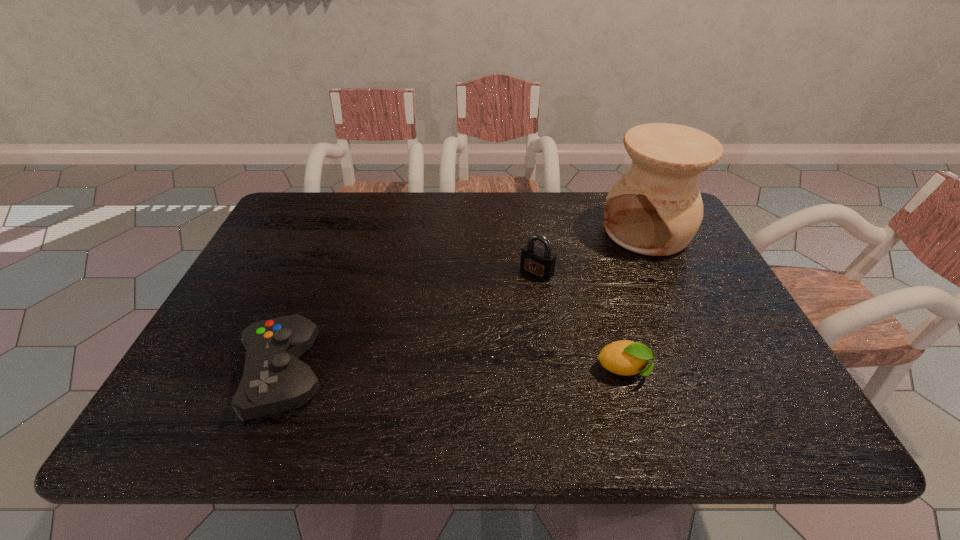
At what (x,y) coordinates should I click in order to perform the action: click on free space on the desktop that is between the leftmost object and the lemon and is positioned on the front of the third shortest object near the keyhole. Please return your answer as a coordinate pair (x, y). Image resolution: width=960 pixels, height=540 pixels. Looking at the image, I should click on (448, 373).

Locate an element on the screen. vacant space on the desktop that is between the leftmost object and the lemon and is positioned at the open side of the tallest object is located at coordinates (478, 373).